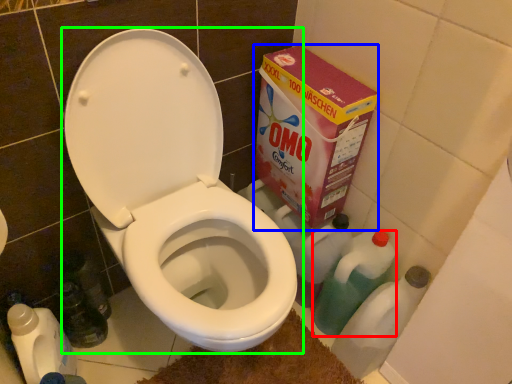
Question: Estimate the real-world distances between objects in this image. Which object is farther from cleaning product (highlighted by a red box), cardboard box (highlighted by a blue box) or toilet (highlighted by a green box)?

Choices:
 (A) cardboard box
 (B) toilet

Answer: (B)